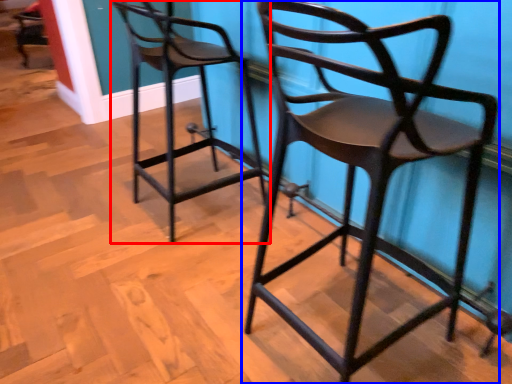
Question: Which point is further to the camera, chair (highlighted by a red box) or chair (highlighted by a blue box)?

Choices:
 (A) chair
 (B) chair

Answer: (A)